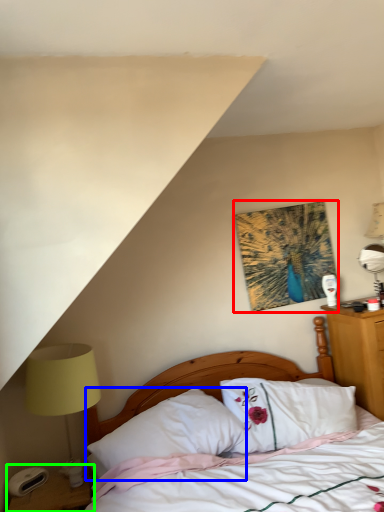
Question: Considering the real-world distances, which object is farthest from picture frame (highlighted by a red box)? pillow (highlighted by a blue box) or nightstand (highlighted by a green box)?

Choices:
 (A) pillow
 (B) nightstand

Answer: (B)